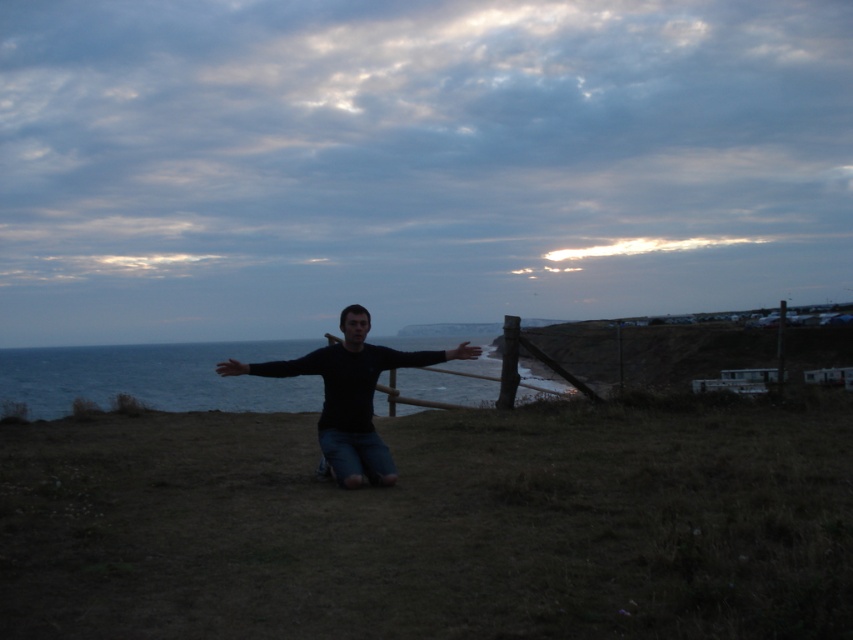
You are standing in the coastal scene and want to take a photo of the blue water at center and the black matte shirt at center. Which object should you focus on first if you want to capture both in the same frame without moving the camera?

You should focus on the black matte shirt at center first because it is closer to the camera than the blue water at center, allowing both to be in focus within the same frame.

You are standing on the beach and see the blue water at center and the black matte shirt at center. Which object is closer to the ground?

The blue water at center is located below the black matte shirt at center, so it is closer to the ground.